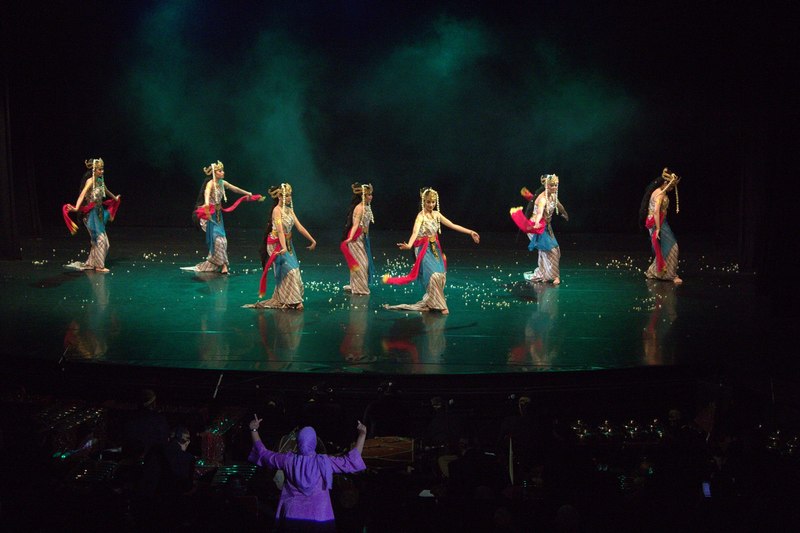
Locate an element on the screen. The image size is (800, 533). stage floor is located at coordinates (186, 297), (146, 240), (72, 306), (485, 264), (321, 259), (594, 253), (744, 257), (697, 331), (574, 350), (306, 339).